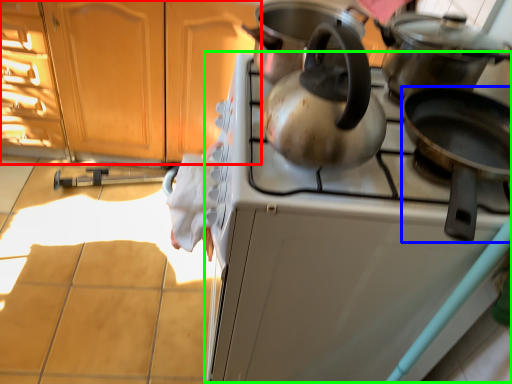
Question: Which is nearer to the cabinetry (highlighted by a red box)? kitchen appliance (highlighted by a blue box) or oven (highlighted by a green box).

Choices:
 (A) kitchen appliance
 (B) oven

Answer: (B)